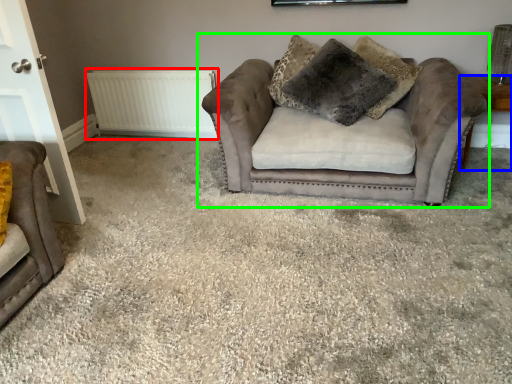
Question: Considering the real-world distances, which object is farthest from radiator (highlighted by a red box)? side table (highlighted by a blue box) or studio couch (highlighted by a green box)?

Choices:
 (A) side table
 (B) studio couch

Answer: (A)